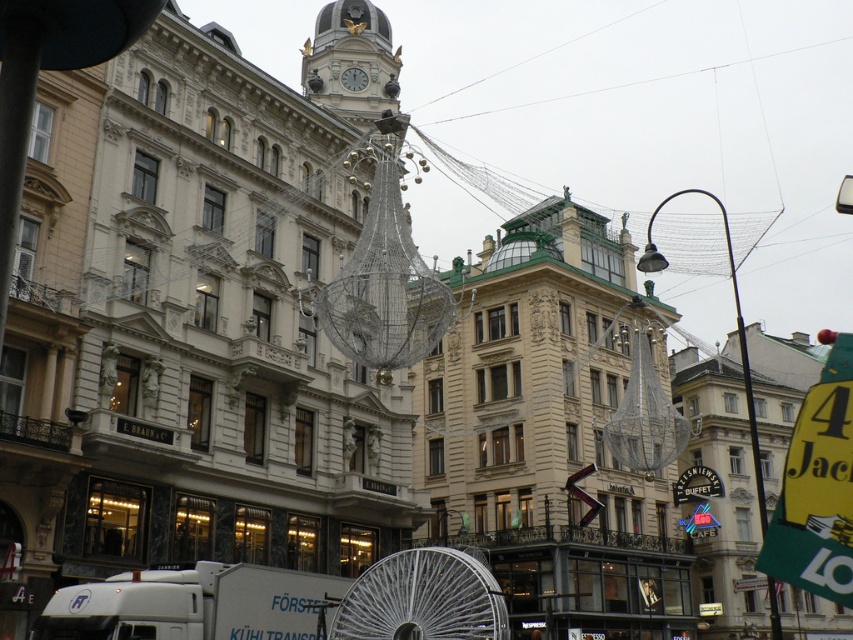
Measure the distance from beige stone tower at center to gold ornate clock tower at upper center.

beige stone tower at center and gold ornate clock tower at upper center are 30.93 meters apart from each other.

Between point (554, 628) and point (390, 81), which one is positioned in front?

Point (554, 628) is in front.

In order to click on beige stone tower at center in this screenshot , I will do `click(552, 432)`.

In the scene shown: Can you confirm if gold ornate clock tower at upper center is positioned to the left of metallic pole at right?

Yes, gold ornate clock tower at upper center is to the left of metallic pole at right.

Is point (357, 80) positioned in front of point (721, 204)?

That is True.

Where is `gold ornate clock tower at upper center`? The height and width of the screenshot is (640, 853). gold ornate clock tower at upper center is located at coordinates (351, 61).

Is yellow paper sign at right below metallic pole at right?

Indeed, yellow paper sign at right is positioned under metallic pole at right.

Can you confirm if yellow paper sign at right is bigger than metallic pole at right?

No, yellow paper sign at right is not bigger than metallic pole at right.

Where is `yellow paper sign at right`? The height and width of the screenshot is (640, 853). yellow paper sign at right is located at coordinates (817, 486).

I want to click on yellow paper sign at right, so click(x=817, y=486).